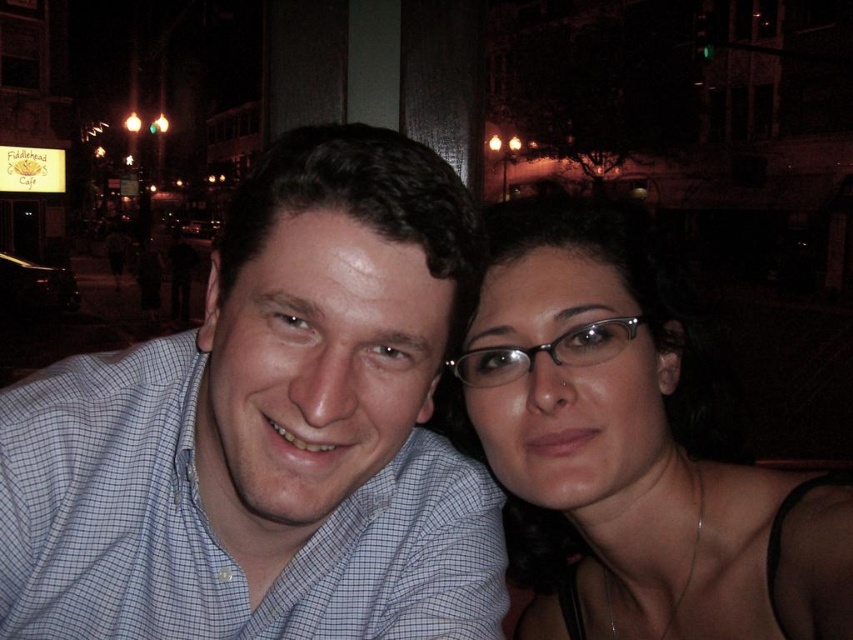
Which of these two, blue checkered shirt at center or metallic frame glasses at center, stands taller?

With more height is blue checkered shirt at center.

Image resolution: width=853 pixels, height=640 pixels. What do you see at coordinates (268, 432) in the screenshot? I see `blue checkered shirt at center` at bounding box center [268, 432].

Locate an element on the screen. The image size is (853, 640). blue checkered shirt at center is located at coordinates (268, 432).

Find the location of a particular element. This screenshot has width=853, height=640. blue checkered shirt at center is located at coordinates (268, 432).

Measure the distance between blue checkered shirt at center and camera.

blue checkered shirt at center is 58.38 centimeters from camera.

Measure the distance between point (183, 592) and camera.

Point (183, 592) is 30.01 inches from camera.

Where is `blue checkered shirt at center`? The width and height of the screenshot is (853, 640). blue checkered shirt at center is located at coordinates (268, 432).

Can you confirm if matte black hair at right is positioned to the right of metallic frame glasses at center?

Indeed, matte black hair at right is positioned on the right side of metallic frame glasses at center.

Is matte black hair at right to the left of metallic frame glasses at center from the viewer's perspective?

No, matte black hair at right is not to the left of metallic frame glasses at center.

You are a GUI agent. You are given a task and a screenshot of the screen. Output one action in this format:
    pyautogui.click(x=<x>, y=<y>)
    Task: Click on the matte black hair at right
    Image resolution: width=853 pixels, height=640 pixels.
    Given the screenshot: What is the action you would take?
    pyautogui.click(x=631, y=449)

What are the coordinates of `matte black hair at right` in the screenshot? It's located at (631, 449).